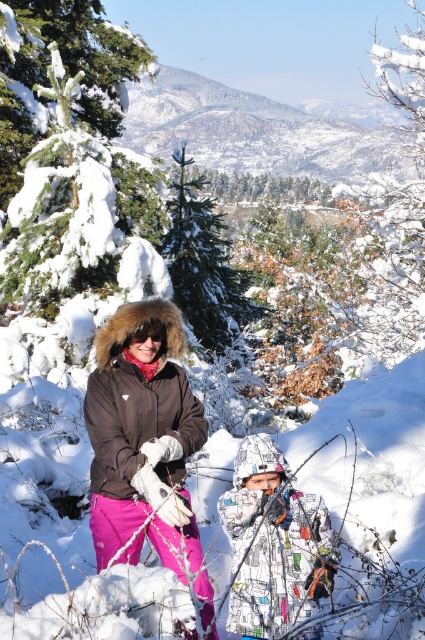
In the scene shown: You are a photographer trying to capture the printed fabric snowsuit at center in the winter scene. You notice a point marked at coordinates (x=274, y=544). Where exactly is this point located on the printed fabric snowsuit at center?

The point at coordinates (x=274, y=544) is located on the printed fabric snowsuit at center.